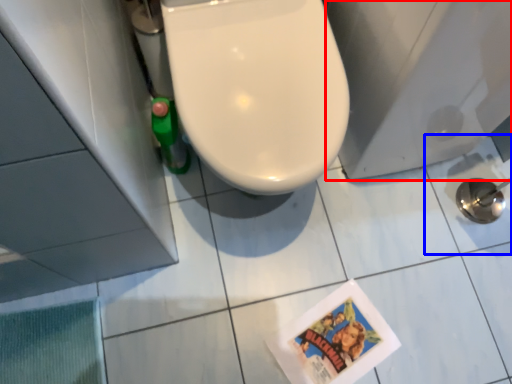
Question: Which object appears closest to the camera in this image, porcelain (highlighted by a red box) or ceramic tile (highlighted by a blue box)?

Choices:
 (A) porcelain
 (B) ceramic tile

Answer: (A)